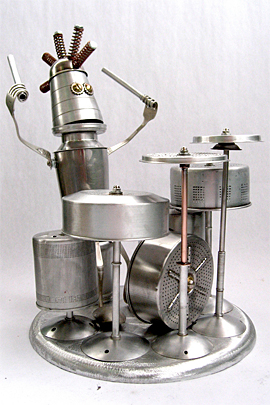
Locate an element on the screen. plate is located at coordinates (171, 367).